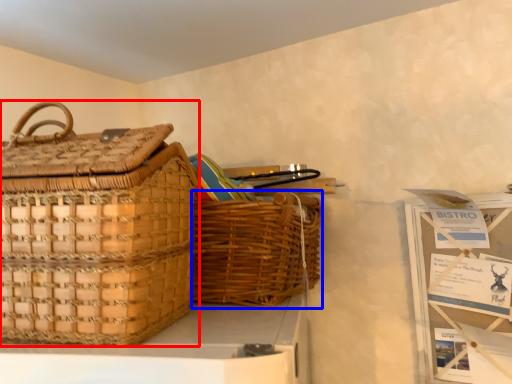
Question: Which of the following is the closest to the observer, picnic basket (highlighted by a red box) or picnic basket (highlighted by a blue box)?

Choices:
 (A) picnic basket
 (B) picnic basket

Answer: (A)